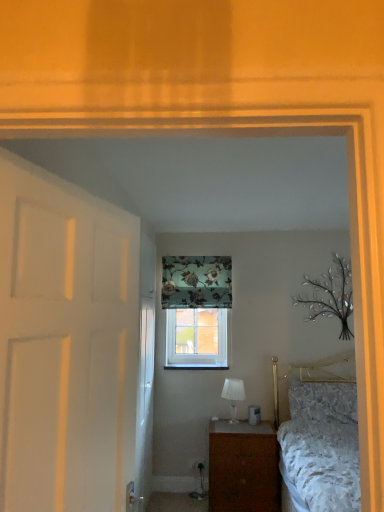
Question: From a real-world perspective, is white glass table lamp at center above or below floral fabric curtain at upper center?

Choices:
 (A) below
 (B) above

Answer: (A)

Question: Considering the positions of white glass table lamp at center and floral fabric curtain at upper center in the image, is white glass table lamp at center taller or shorter than floral fabric curtain at upper center?

Choices:
 (A) short
 (B) tall

Answer: (A)

Question: Which of these objects is positioned closest to the white glass table lamp at center?

Choices:
 (A) white glossy door at left, placed as the first door when sorted from back to front
 (B) white matte door at left, the 2th door when ordered from back to front
 (C) fluffy white pillow at lower right
 (D) clear glass window at center
 (E) floral fabric curtain at upper center

Answer: (D)

Question: Estimate the real-world distances between objects in this image. Which object is closer to the fluffy white pillow at lower right?

Choices:
 (A) floral fabric curtain at upper center
 (B) clear glass window at center
 (C) white glossy door at left, placed as the first door when sorted from back to front
 (D) white glass table lamp at center
 (E) white matte door at left, positioned as the 1th door in front-to-back order

Answer: (D)